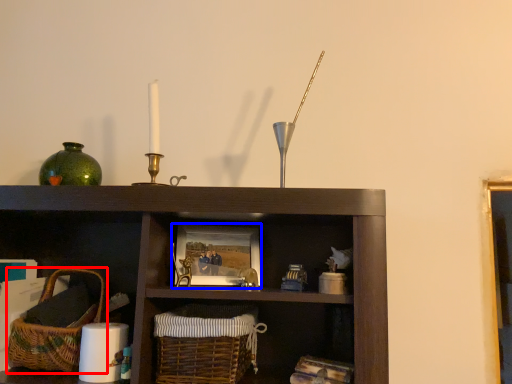
Question: Which object is further to the camera taking this photo, basket (highlighted by a red box) or picture frame (highlighted by a blue box)?

Choices:
 (A) basket
 (B) picture frame

Answer: (B)